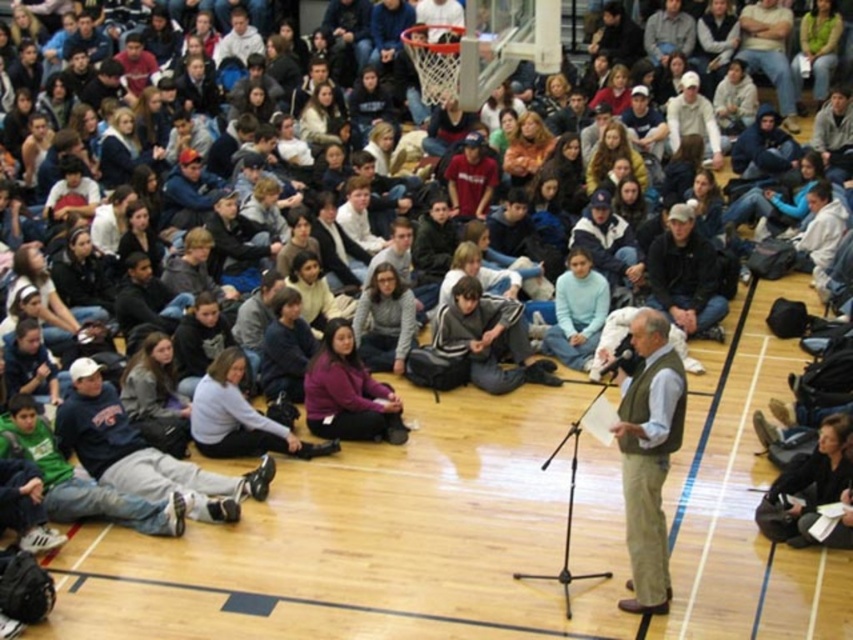
Question: Is green vest at center smaller than dark gray sweater at center?

Choices:
 (A) no
 (B) yes

Answer: (A)

Question: Which object appears closest to the camera in this image?

Choices:
 (A) green vest at center
 (B) dark gray sweater at center

Answer: (A)

Question: Does green vest at center have a smaller size compared to dark gray sweater at center?

Choices:
 (A) yes
 (B) no

Answer: (B)

Question: Which of the following is the closest to the observer?

Choices:
 (A) dark gray sweater at center
 (B) green vest at center

Answer: (B)

Question: From the image, what is the correct spatial relationship of green vest at center in relation to dark gray sweater at center?

Choices:
 (A) above
 (B) below

Answer: (B)

Question: Which object appears closest to the camera in this image?

Choices:
 (A) green vest at center
 (B) dark gray sweater at center

Answer: (A)